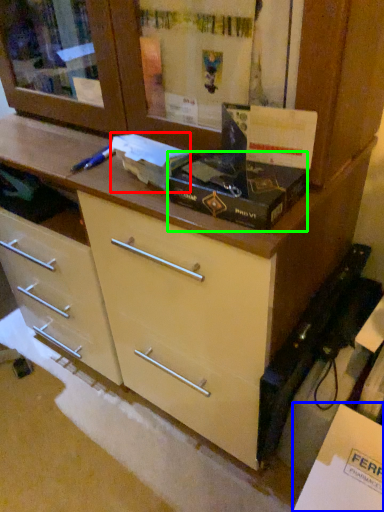
Question: Estimate the real-world distances between objects in this image. Which object is closer to box (highlighted by a red box), cabinetry (highlighted by a blue box) or box (highlighted by a green box)?

Choices:
 (A) cabinetry
 (B) box

Answer: (B)